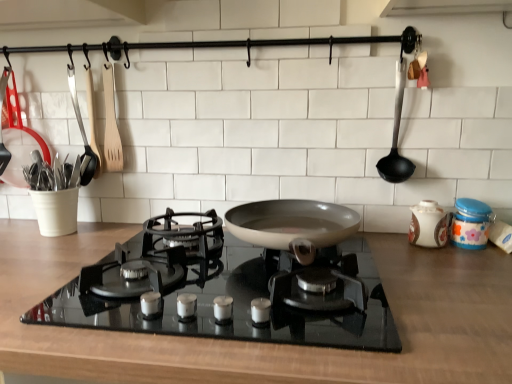
The height and width of the screenshot is (384, 512). Identify the location of free space to the left of blue glossy jar at right, marked as the 1th kitchen appliance in a right-to-left arrangement. (406, 250).